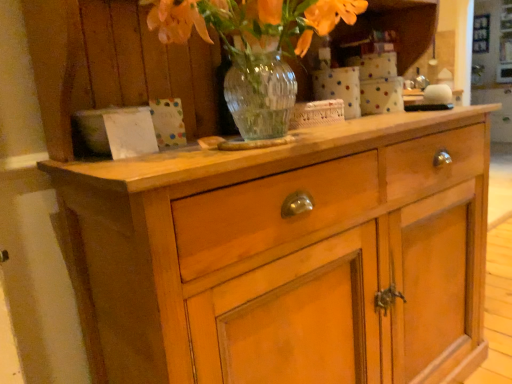
Question: Is translucent glass vase at upper center not inside wooden cabinet at center?

Choices:
 (A) yes
 (B) no

Answer: (B)

Question: Is translucent glass vase at upper center positioned before wooden cabinet at center?

Choices:
 (A) no
 (B) yes

Answer: (A)

Question: Is translucent glass vase at upper center touching wooden cabinet at center?

Choices:
 (A) yes
 (B) no

Answer: (B)

Question: Could you tell me if translucent glass vase at upper center is turned towards wooden cabinet at center?

Choices:
 (A) no
 (B) yes

Answer: (B)

Question: Is translucent glass vase at upper center behind wooden cabinet at center?

Choices:
 (A) yes
 (B) no

Answer: (A)

Question: Does translucent glass vase at upper center have a lesser height compared to wooden cabinet at center?

Choices:
 (A) yes
 (B) no

Answer: (A)

Question: Considering the relative sizes of wooden cabinet at center and translucent glass vase at upper center in the image provided, is wooden cabinet at center thinner than translucent glass vase at upper center?

Choices:
 (A) yes
 (B) no

Answer: (B)

Question: From a real-world perspective, is wooden cabinet at center on top of translucent glass vase at upper center?

Choices:
 (A) no
 (B) yes

Answer: (A)

Question: From a real-world perspective, is wooden cabinet at center located beneath translucent glass vase at upper center?

Choices:
 (A) no
 (B) yes

Answer: (B)

Question: Can you confirm if wooden cabinet at center is bigger than translucent glass vase at upper center?

Choices:
 (A) no
 (B) yes

Answer: (B)

Question: Is wooden cabinet at center taller than translucent glass vase at upper center?

Choices:
 (A) yes
 (B) no

Answer: (A)

Question: Considering the relative sizes of wooden cabinet at center and translucent glass vase at upper center in the image provided, is wooden cabinet at center shorter than translucent glass vase at upper center?

Choices:
 (A) no
 (B) yes

Answer: (A)

Question: Considering the relative positions of translucent glass vase at upper center and wooden cabinet at center in the image provided, is translucent glass vase at upper center to the left or to the right of wooden cabinet at center?

Choices:
 (A) right
 (B) left

Answer: (B)